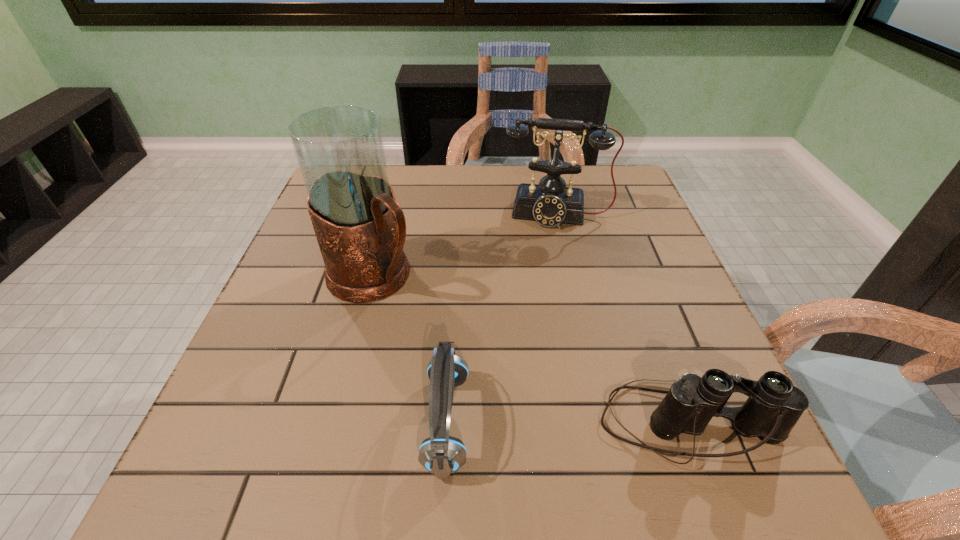
Where is `headset`? This screenshot has width=960, height=540. headset is located at coordinates (441, 454).

The height and width of the screenshot is (540, 960). Identify the location of binoculars. (774, 406).

The image size is (960, 540). I want to click on the third nearest object, so click(x=360, y=228).

Locate an element on the screen. This screenshot has width=960, height=540. pitcher is located at coordinates (360, 228).

Identify the location of the third shortest object. (551, 203).

Locate an element on the screen. The height and width of the screenshot is (540, 960). telephone is located at coordinates (551, 203).

Locate an element on the screen. The width and height of the screenshot is (960, 540). vacant space located on the ear cups of the second object from left to right is located at coordinates coord(527,422).

Find the location of a particular element. This screenshot has height=540, width=960. vacant position located 0.240m on the left of the binoculars is located at coordinates (457, 423).

This screenshot has height=540, width=960. I want to click on vacant space located 0.370m with the handle on the side of the leftmost object, so click(x=540, y=404).

The height and width of the screenshot is (540, 960). In order to click on blank space located with the handle on the side of the leftmost object in this screenshot , I will do `click(550, 411)`.